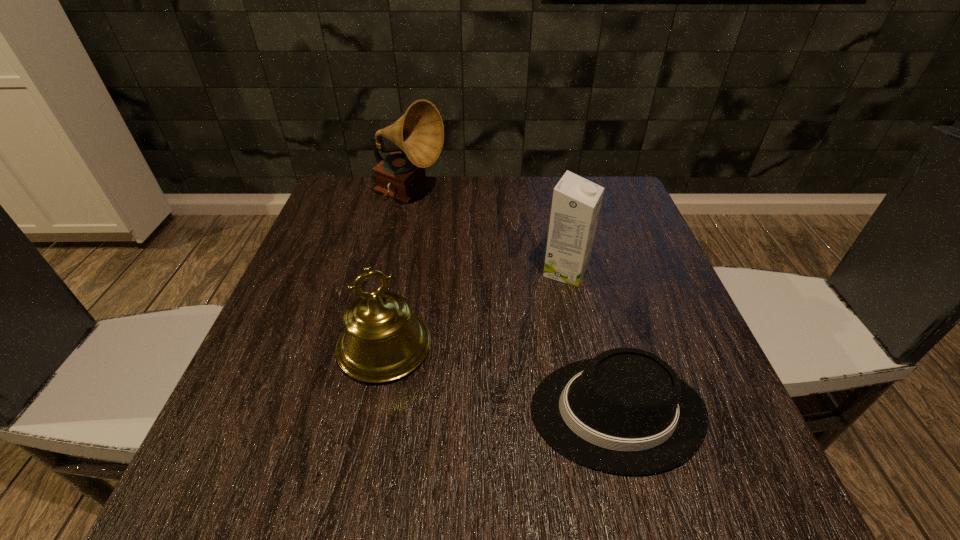
The height and width of the screenshot is (540, 960). Identify the location of vacant area that lies between the bell and the phonograph record. (397, 271).

What are the coordinates of `vacant region between the shortest object and the bell` in the screenshot? It's located at (500, 380).

Where is `vacant space that's between the fedora and the farthest object`? The height and width of the screenshot is (540, 960). vacant space that's between the fedora and the farthest object is located at coordinates (513, 304).

Where is `vacant area that lies between the second farthest object and the tallest object`? The height and width of the screenshot is (540, 960). vacant area that lies between the second farthest object and the tallest object is located at coordinates (488, 233).

I want to click on object that is the third closest to the farthest object, so click(625, 411).

Locate an element on the screen. The height and width of the screenshot is (540, 960). object that can be found as the closest to the farthest object is located at coordinates (576, 203).

Where is `vacant region that satisfies the following two spatial constraints: 1. on the horn of the carton; 2. on the left side of the phonograph record`? The image size is (960, 540). vacant region that satisfies the following two spatial constraints: 1. on the horn of the carton; 2. on the left side of the phonograph record is located at coordinates (394, 271).

Locate an element on the screen. vacant area in the image that satisfies the following two spatial constraints: 1. on the horn of the third nearest object; 2. on the right side of the tallest object is located at coordinates (394, 271).

Where is `vacant area in the image that satisfies the following two spatial constraints: 1. on the back side of the carton; 2. on the horn of the tallest object`? vacant area in the image that satisfies the following two spatial constraints: 1. on the back side of the carton; 2. on the horn of the tallest object is located at coordinates (549, 195).